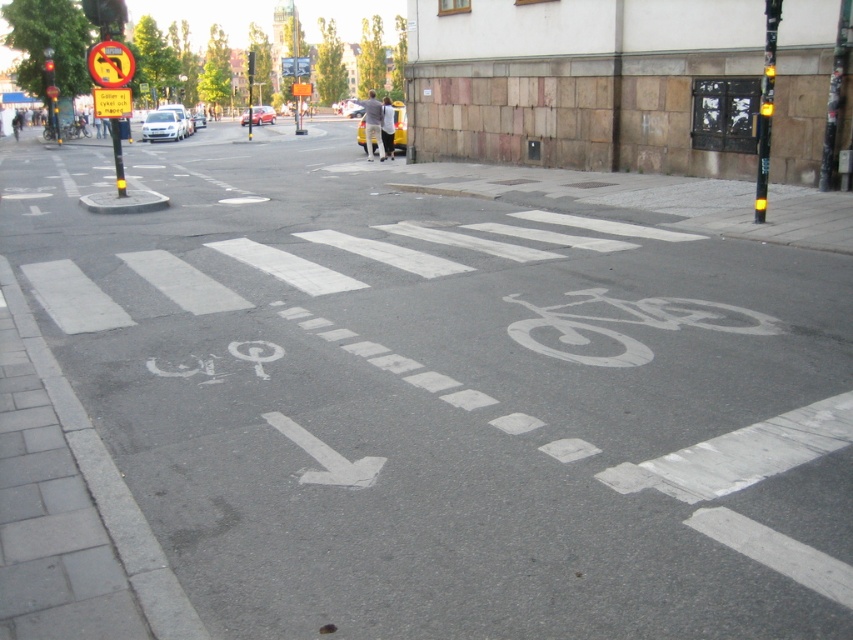
You are a delivery person trying to park your yellow matte car at center in a space between two other vehicles. The parking space has a width restriction of 1.8 meters. Can your car fit if the metallic reflective sign at upper center is 2 meters wide?

The yellow matte car at center is thinner than the metallic reflective sign at upper center, which is 2 meters wide. Since the car is thinner than 2 meters, it should fit within the 1.8 meter width restriction as long as the car is narrower than 1.8 meters. However, without exact measurements, we can only infer that the car is narrower than 2 meters, so it might still be possible.

You are a delivery person on a bike and need to cross the street at the pedestrian crossing. The bike lane is marked at point (461, 420). Where should you position your bike relative to the bike lane to follow traffic rules?

You should position your bike within the white painted bike lane at lower left at point (461, 420) as it is designated for cyclists.

You are a pedestrian standing at the sidewalk next to the yellow matte car at center. You want to cross the street to reach the park located 100 feet away. Can you safely walk from your current position to the park without needing to cross the road again?

The yellow matte car at center and camera are 78.04 feet apart. Since the park is 100 feet away, you would need to cross the road again to reach it. However, the scene shows a pedestrian crossing and a designated bicycle lane, so you should cross at the designated area first, then continue walking along the sidewalk on the other side to avoid crossing again.